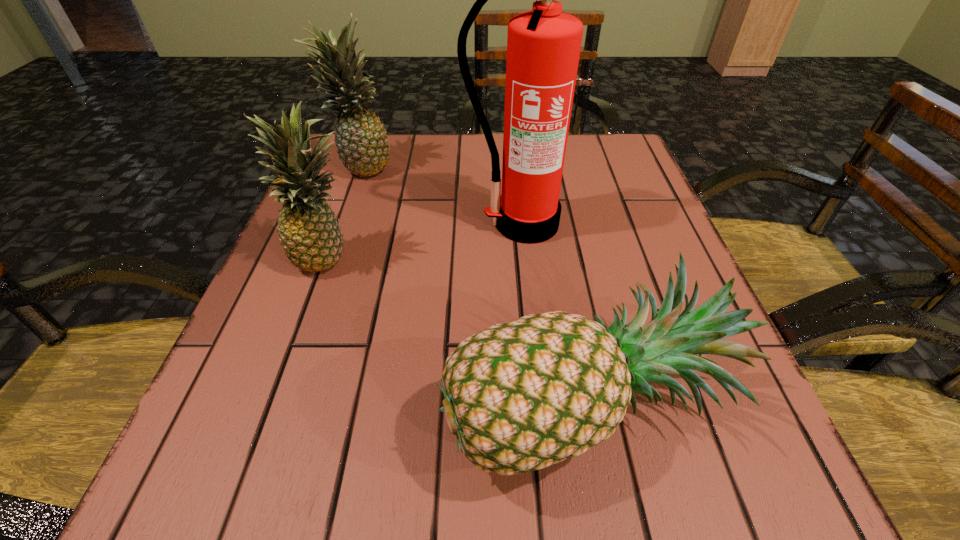
Point out which pineapple is positioned as the nearest to the second nearest pineapple. Please provide its 2D coordinates. Your answer should be formatted as a tuple, i.e. [(x, y)], where the tuple contains the x and y coordinates of a point satisfying the conditions above.

[(361, 141)]